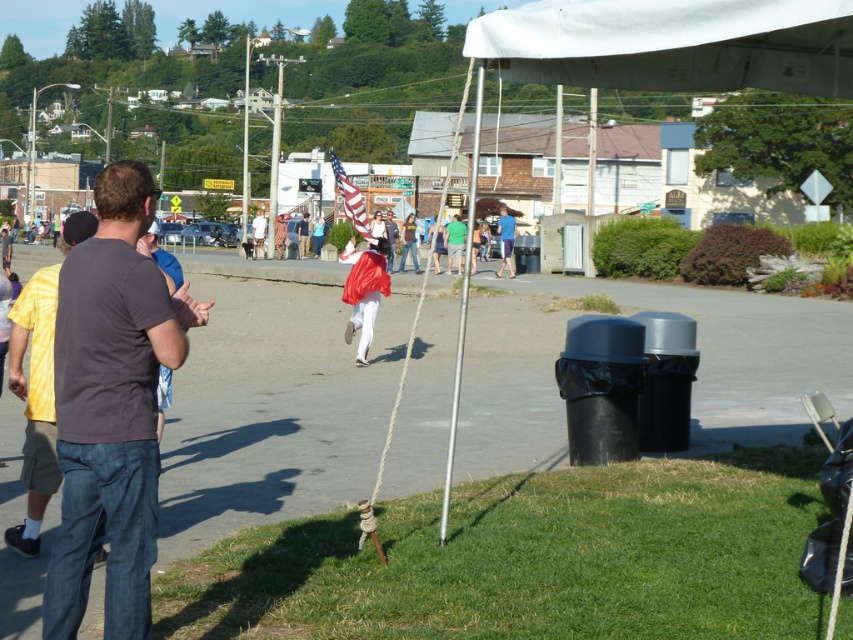
Which is behind, point (634, 65) or point (508, 244)?

The point (508, 244) is more distant.

Does white fabric canopy at upper center appear on the right side of blue fabric at center?

Incorrect, white fabric canopy at upper center is not on the right side of blue fabric at center.

Locate an element on the screen. white fabric canopy at upper center is located at coordinates (672, 44).

You are a GUI agent. You are given a task and a screenshot of the screen. Output one action in this format:
    pyautogui.click(x=<x>, y=<y>)
    Task: Click on the shiny red fabric at center
    The image size is (853, 640).
    Given the screenshot: What is the action you would take?
    pyautogui.click(x=364, y=291)

The height and width of the screenshot is (640, 853). What do you see at coordinates (364, 291) in the screenshot?
I see `shiny red fabric at center` at bounding box center [364, 291].

The height and width of the screenshot is (640, 853). What are the coordinates of `shiny red fabric at center` in the screenshot? It's located at (364, 291).

Can you confirm if white fabric canopy at upper center is smaller than light brown wooden sign at center?

Correct, white fabric canopy at upper center occupies less space than light brown wooden sign at center.

At what (x,y) coordinates should I click in order to perform the action: click on white fabric canopy at upper center. Please return your answer as a coordinate pair (x, y). The height and width of the screenshot is (640, 853). Looking at the image, I should click on (672, 44).